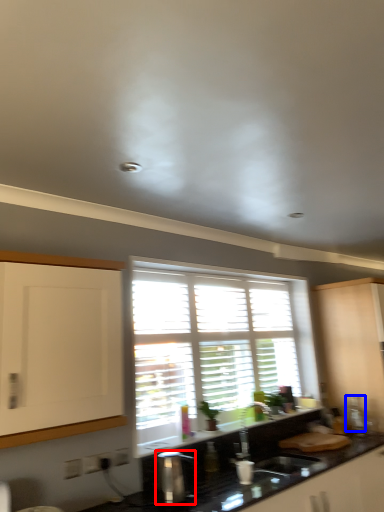
Question: Which object appears farthest to the camera in this image, appliance (highlighted by a red box) or appliance (highlighted by a blue box)?

Choices:
 (A) appliance
 (B) appliance

Answer: (B)